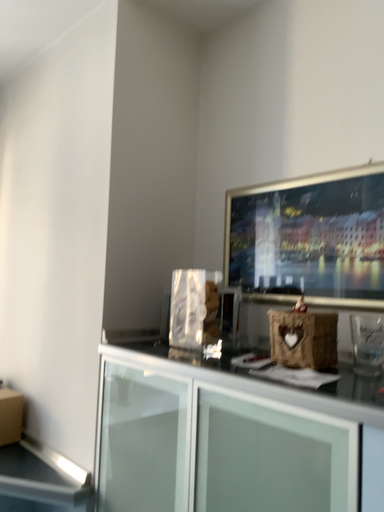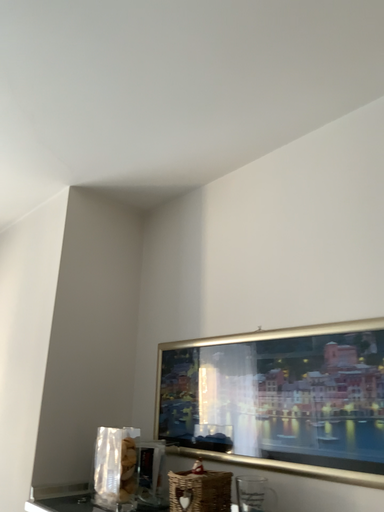
Question: How did the camera likely rotate when shooting the video?

Choices:
 (A) rotated upward
 (B) rotated downward

Answer: (A)